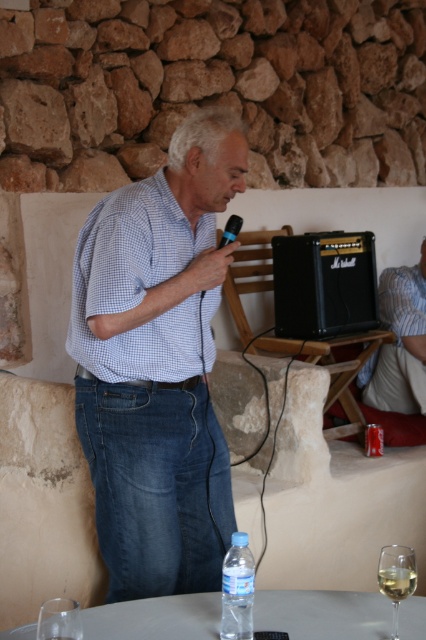
Who is shorter, black matte amplifier at right or clear plastic bottle at lower center?

Standing shorter between the two is clear plastic bottle at lower center.

Is point (299, 284) in front of point (224, 608)?

No, (299, 284) is further to viewer.

Locate an element on the screen. The image size is (426, 640). black matte amplifier at right is located at coordinates (324, 284).

You are a GUI agent. You are given a task and a screenshot of the screen. Output one action in this format:
    pyautogui.click(x=<x>, y=<y>)
    Task: Click on the black matte amplifier at right
    
    Given the screenshot: What is the action you would take?
    pyautogui.click(x=324, y=284)

Which of these two, wooden table at center or clear plastic bottle at lower center, stands taller?

wooden table at center

Does wooden table at center have a lesser width compared to clear plastic bottle at lower center?

No, wooden table at center is not thinner than clear plastic bottle at lower center.

Which is behind, point (333, 344) or point (226, 627)?

Point (333, 344)

Where is `wooden table at center`? Image resolution: width=426 pixels, height=640 pixels. wooden table at center is located at coordinates (328, 368).

The image size is (426, 640). Identify the location of black matte amplifier at right. (324, 284).

Is black matte amplifier at right taller than blue checkered shirt at upper center?

No.

Does point (345, 305) lie in front of point (416, 340)?

Yes, point (345, 305) is in front of point (416, 340).

Find the location of a particular element. black matte amplifier at right is located at coordinates (324, 284).